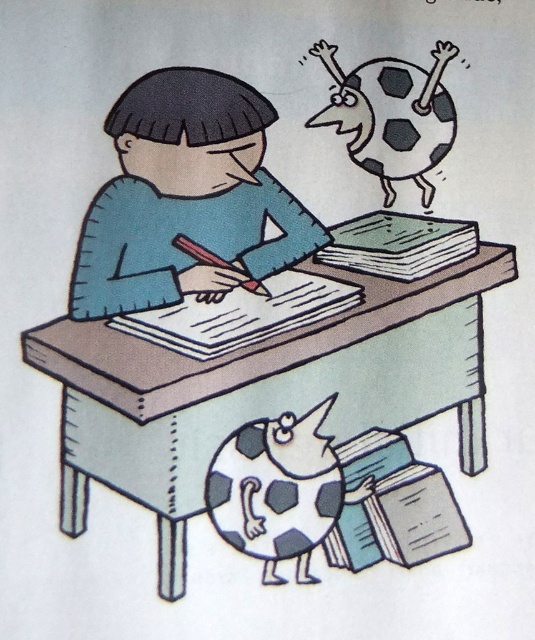
Question: Which object is the closest to the blue matte shirt at center?

Choices:
 (A) light brown wooden table at center
 (B) black and white spotted figure at upper right

Answer: (A)

Question: Where is patterned soccer ball at lower center located in relation to black and white spotted figure at upper right in the image?

Choices:
 (A) right
 (B) left

Answer: (B)

Question: Can you confirm if blue matte shirt at center is positioned above black and white spotted figure at upper right?

Choices:
 (A) yes
 (B) no

Answer: (B)

Question: Which of the following is the closest to the observer?

Choices:
 (A) (286, 513)
 (B) (164, 240)
 (C) (279, 540)
 (D) (377, 67)

Answer: (C)

Question: Can you confirm if light brown wooden table at center is wider than blue matte shirt at center?

Choices:
 (A) no
 (B) yes

Answer: (B)

Question: Which is nearer to the patterned soccer ball at lower center?

Choices:
 (A) light brown wooden table at center
 (B) black and white spotted figure at upper right
 (C) blue matte shirt at center

Answer: (A)